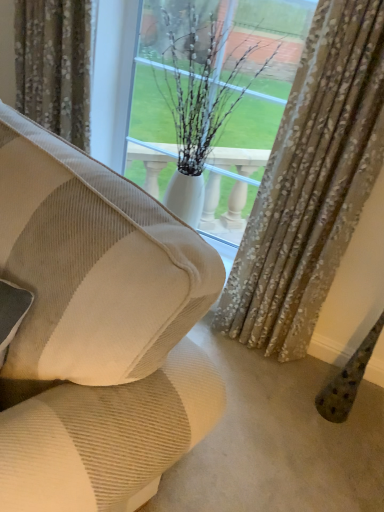
Question: From the image's perspective, is white glossy vase at center located above textured beige curtain at center, the first curtain from the right?

Choices:
 (A) no
 (B) yes

Answer: (B)

Question: Is white glossy vase at center turned away from textured beige curtain at center, the 2th curtain from the left?

Choices:
 (A) no
 (B) yes

Answer: (A)

Question: Is white glossy vase at center completely or partially outside of textured beige curtain at center, the first curtain from the right?

Choices:
 (A) no
 (B) yes

Answer: (B)

Question: Is white glossy vase at center at the right side of textured beige curtain at center, the first curtain from the right?

Choices:
 (A) yes
 (B) no

Answer: (B)

Question: Is the depth of white glossy vase at center greater than that of textured beige curtain at center, the first curtain from the right?

Choices:
 (A) yes
 (B) no

Answer: (A)

Question: Considering the positions of point tap(3, 228) and point tap(67, 36), is point tap(3, 228) closer or farther from the camera than point tap(67, 36)?

Choices:
 (A) closer
 (B) farther

Answer: (A)

Question: From a real-world perspective, relative to patterned fabric curtain at upper center, marked as the 2th curtain in a right-to-left arrangement, is beige corduroy couch at center vertically above or below?

Choices:
 (A) below
 (B) above

Answer: (A)

Question: Would you say beige corduroy couch at center is to the left or to the right of patterned fabric curtain at upper center, marked as the 2th curtain in a right-to-left arrangement, in the picture?

Choices:
 (A) right
 (B) left

Answer: (A)

Question: Based on their sizes in the image, would you say beige corduroy couch at center is bigger or smaller than patterned fabric curtain at upper center, placed as the 1th curtain when sorted from left to right?

Choices:
 (A) big
 (B) small

Answer: (A)

Question: Is beige corduroy couch at center in front of or behind white glossy vase at center in the image?

Choices:
 (A) behind
 (B) front

Answer: (B)

Question: From a real-world perspective, relative to white glossy vase at center, is beige corduroy couch at center vertically above or below?

Choices:
 (A) below
 (B) above

Answer: (A)

Question: Is beige corduroy couch at center bigger or smaller than white glossy vase at center?

Choices:
 (A) big
 (B) small

Answer: (A)

Question: From the image's perspective, is beige corduroy couch at center located above or below white glossy vase at center?

Choices:
 (A) below
 (B) above

Answer: (A)

Question: Is patterned fabric curtain at upper center, marked as the 2th curtain in a right-to-left arrangement, taller or shorter than white glossy vase at center?

Choices:
 (A) tall
 (B) short

Answer: (B)

Question: Considering the positions of patterned fabric curtain at upper center, marked as the 2th curtain in a right-to-left arrangement, and white glossy vase at center in the image, is patterned fabric curtain at upper center, marked as the 2th curtain in a right-to-left arrangement, wider or thinner than white glossy vase at center?

Choices:
 (A) wide
 (B) thin

Answer: (B)